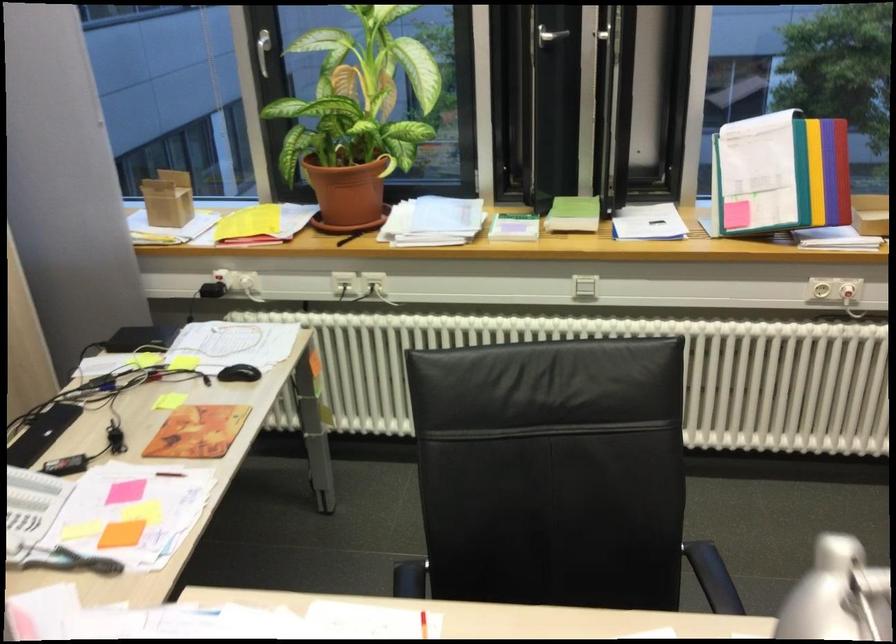
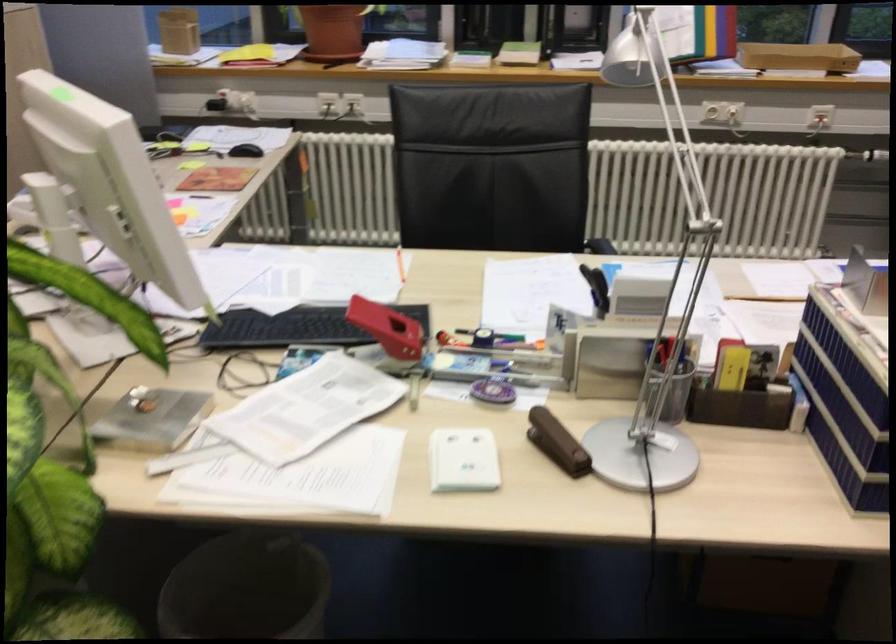
In the second image, find the point that corresponds to (350,193) in the first image.

(332, 31)